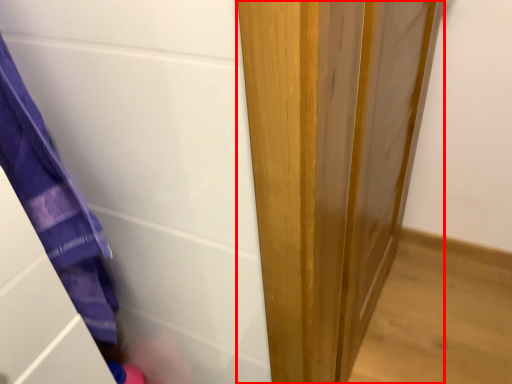
Question: Observing the image, what is the correct spatial positioning of door (annotated by the red box) in reference to screen door?

Choices:
 (A) right
 (B) left

Answer: (A)